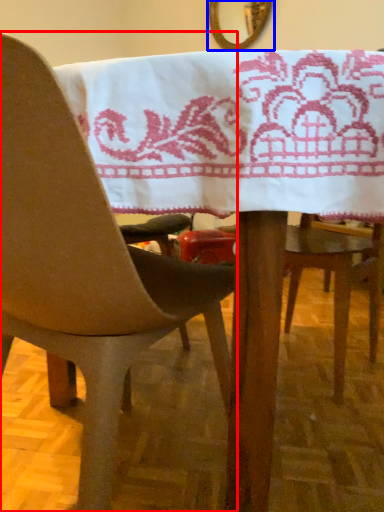
Question: Which object is closer to the camera taking this photo, chair (highlighted by a red box) or mirror (highlighted by a blue box)?

Choices:
 (A) chair
 (B) mirror

Answer: (A)